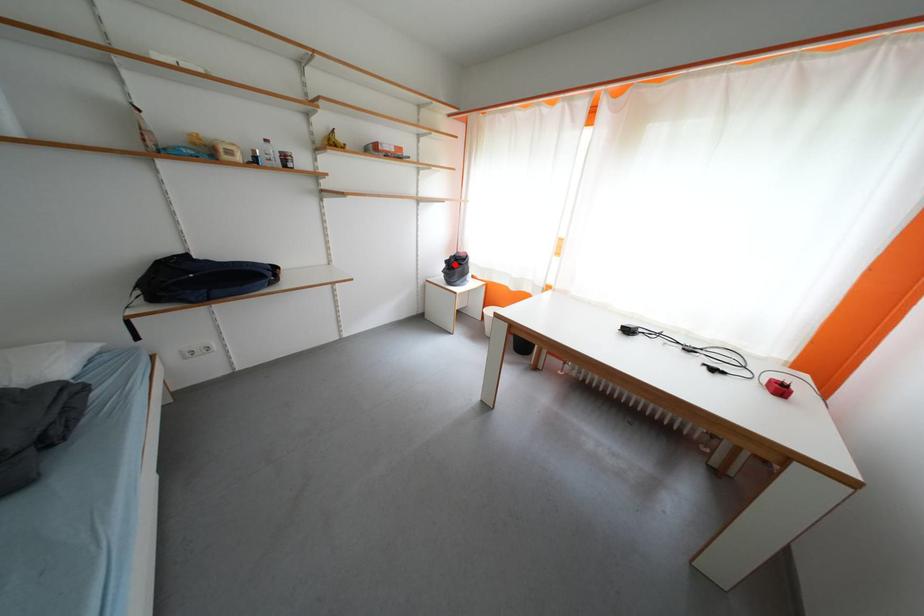
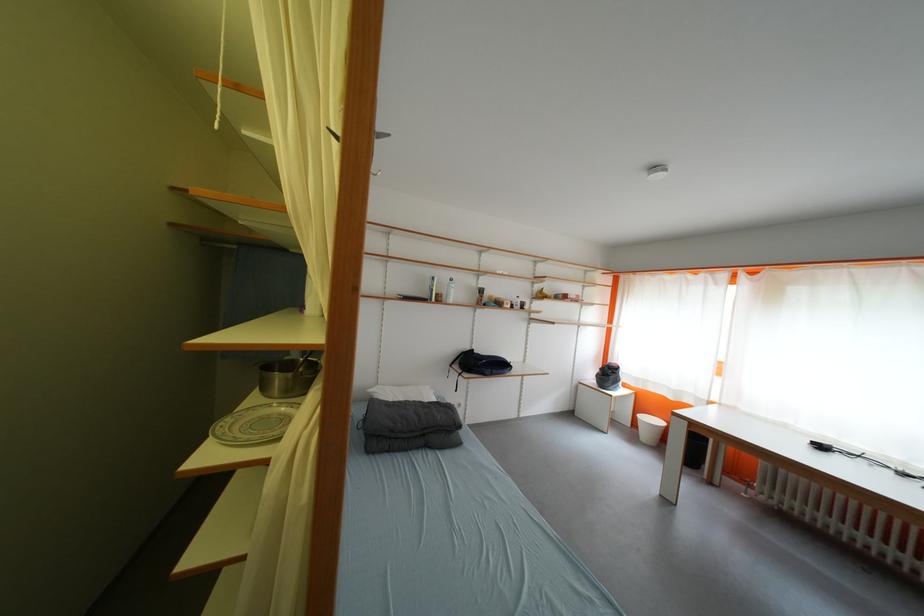
In the second image, find the point that corresponds to the highlighted location in the first image.

(610, 371)